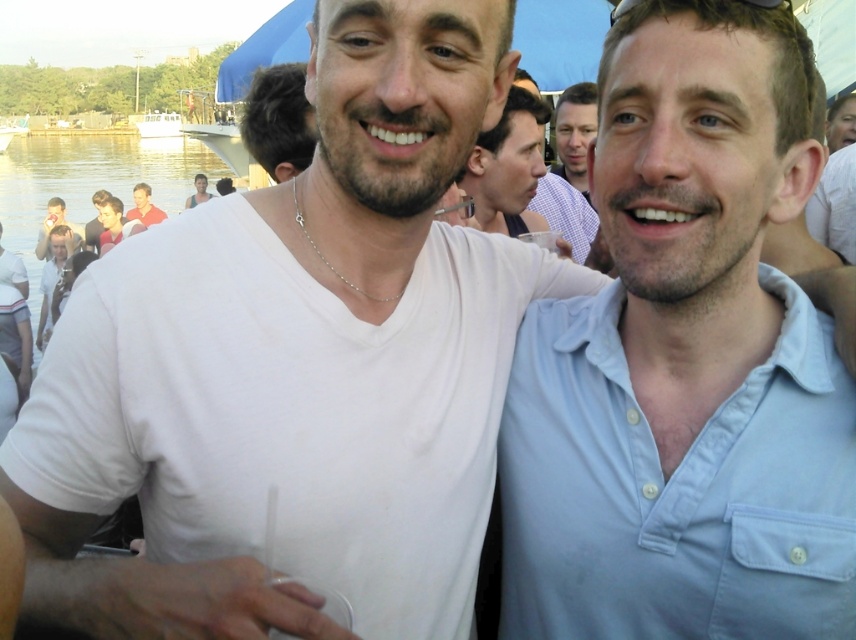
Question: Does matte white shirt at upper right appear on the left side of matte black tank top at center?

Choices:
 (A) yes
 (B) no

Answer: (B)

Question: Based on their relative distances, which object is nearer to the matte black shirt at upper left?

Choices:
 (A) black rubber goggles at upper center
 (B) light blue button-down shirt at center
 (C) matte white shirt at upper right

Answer: (C)

Question: Which object is the farthest from the black rubber goggles at upper center?

Choices:
 (A) matte red shirt at upper left
 (B) dark brown hair at upper left

Answer: (A)

Question: Which object is closer to the camera taking this photo?

Choices:
 (A) matte black shirt at upper left
 (B) light brown hair at upper left

Answer: (A)

Question: Is dark brown hair at upper left above black rubber goggles at upper center?

Choices:
 (A) no
 (B) yes

Answer: (B)

Question: Does light blue button-down shirt at center lie in front of matte red shirt at upper left?

Choices:
 (A) no
 (B) yes

Answer: (B)